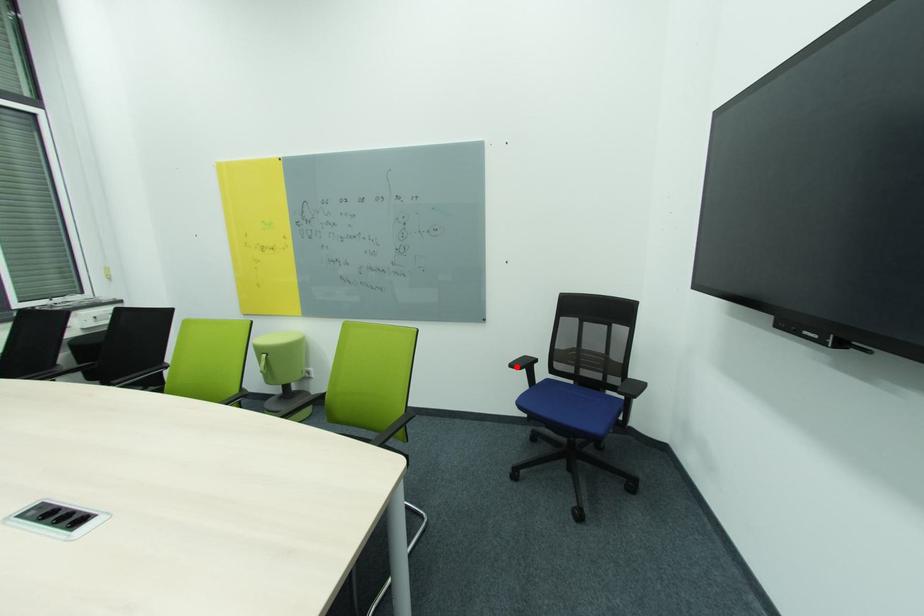
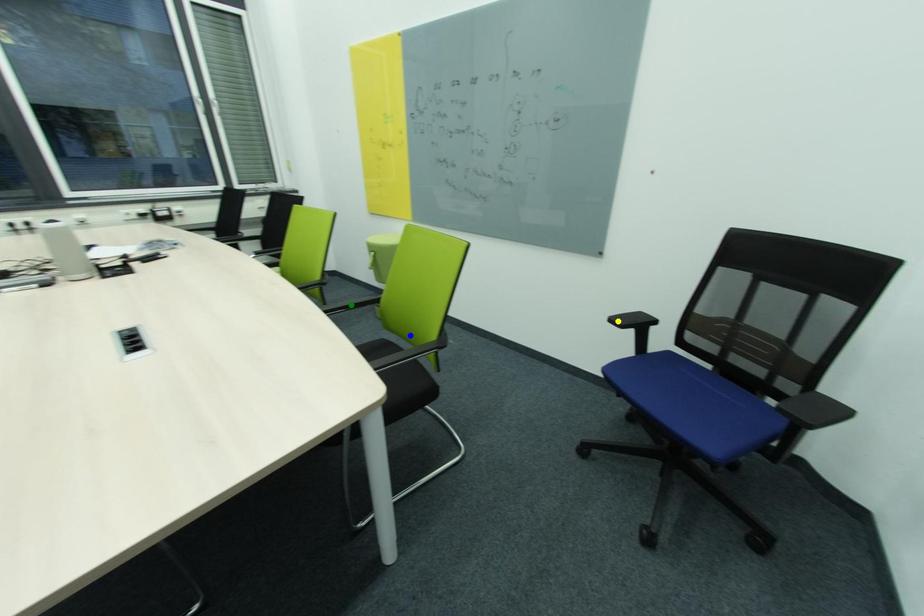
Question: I am providing you with two images of the same scene from different viewpoints. A red point is marked on the first image. You are given multiple points on the second image. In image 2, which mark is for the same physical point as the one in image 1?

Choices:
 (A) green point
 (B) yellow point
 (C) blue point

Answer: (B)